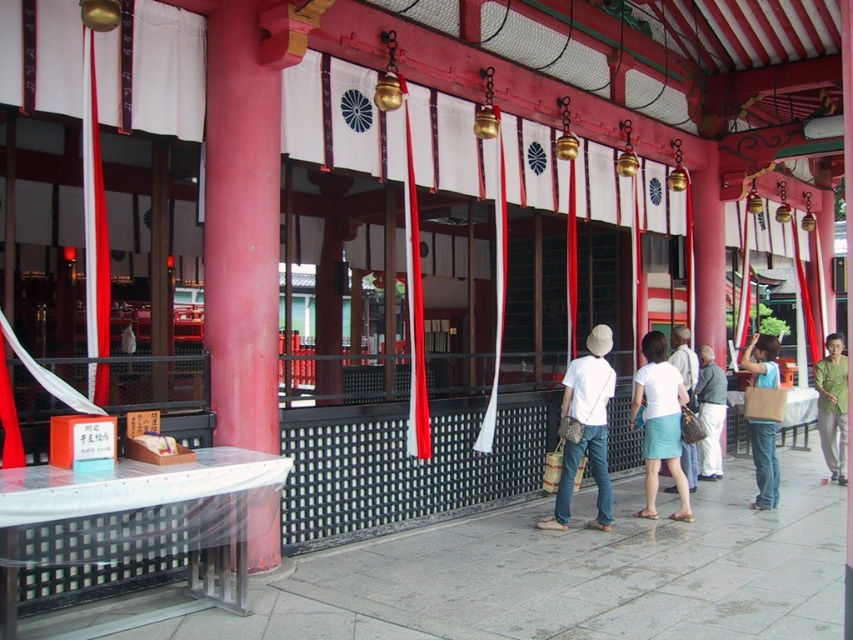
Question: Which of the following is the closest to the observer?

Choices:
 (A) pyautogui.click(x=560, y=490)
 (B) pyautogui.click(x=674, y=368)
 (C) pyautogui.click(x=840, y=461)
 (D) pyautogui.click(x=685, y=374)

Answer: (A)

Question: Can you confirm if denim jeans at center is positioned to the right of green cotton shirt at right?

Choices:
 (A) no
 (B) yes

Answer: (A)

Question: Is white woven basket at center below green cotton shirt at right?

Choices:
 (A) no
 (B) yes

Answer: (A)

Question: Which object appears farthest from the camera in this image?

Choices:
 (A) green cotton shirt at right
 (B) light blue denim jeans at center
 (C) white cotton skirt at center

Answer: (A)

Question: Is white woven basket at center to the right of denim shorts at center from the viewer's perspective?

Choices:
 (A) yes
 (B) no

Answer: (B)

Question: Which point is closer to the camera?

Choices:
 (A) (815, 372)
 (B) (680, 358)
 (C) (746, 362)
 (D) (701, 388)

Answer: (C)